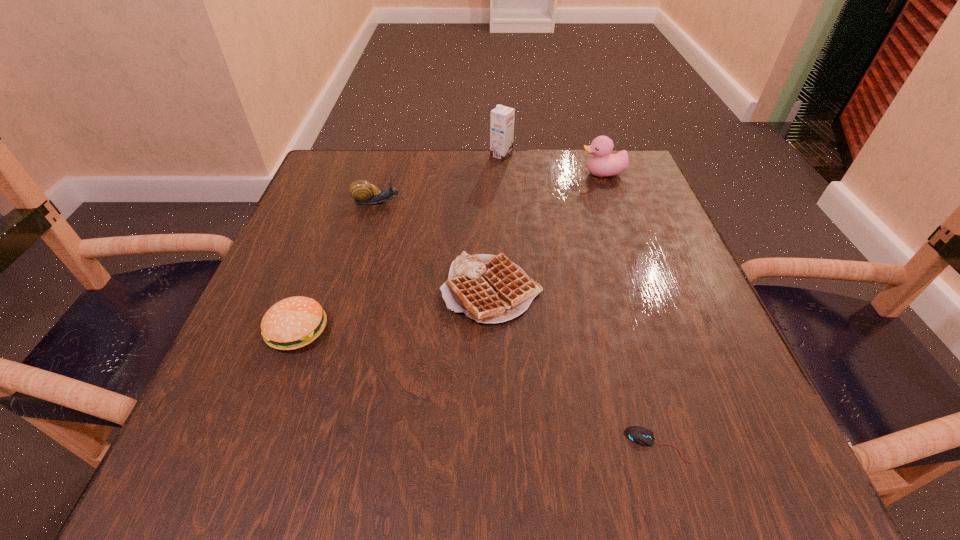
I want to click on vacant region between the second farthest object and the waffle, so click(x=547, y=232).

In order to click on vacant region between the patty and the farthest object in this screenshot , I will do `click(399, 243)`.

Where is `vacant space that is in between the mouse and the second farthest object`? This screenshot has width=960, height=540. vacant space that is in between the mouse and the second farthest object is located at coordinates (630, 309).

Find the location of a particular element. empty location between the shortest object and the fifth tallest object is located at coordinates (574, 367).

Identify which object is the closest to the farthest object. Please provide its 2D coordinates. Your answer should be formatted as a tuple, i.e. [(x, y)], where the tuple contains the x and y coordinates of a point satisfying the conditions above.

[(603, 164)]

Where is `object that is the fifth closest to the waffle`? object that is the fifth closest to the waffle is located at coordinates (502, 118).

Image resolution: width=960 pixels, height=540 pixels. In order to click on vacant position in the image that satisfies the following two spatial constraints: 1. on the front-facing side of the third tallest object; 2. on the left side of the fifth tallest object in this screenshot , I will do `click(353, 291)`.

Find the location of a particular element. vacant space that satisfies the following two spatial constraints: 1. on the front-facing side of the fourth shortest object; 2. on the right side of the nearest object is located at coordinates (310, 444).